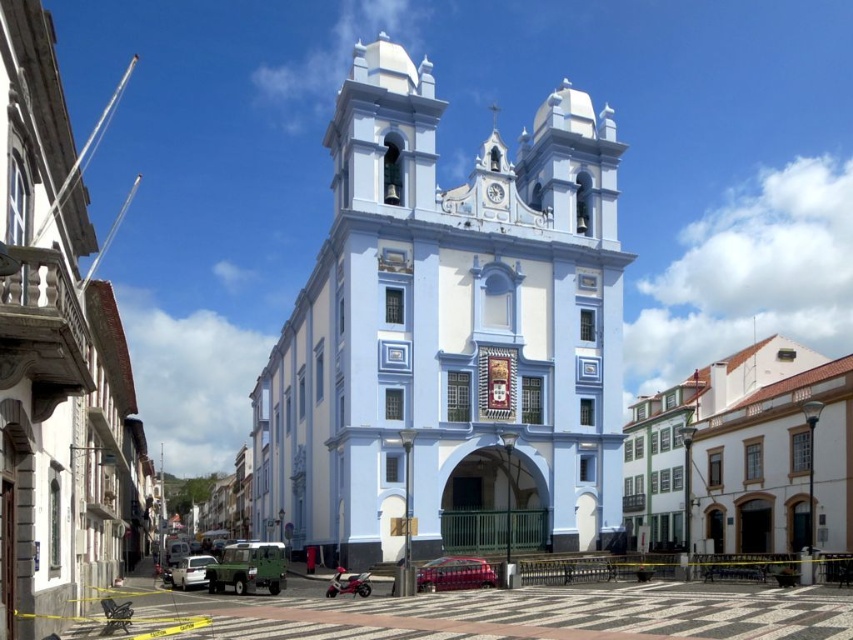
How distant is light blue painted stone church at center from green matte truck at center?

The distance of light blue painted stone church at center from green matte truck at center is 17.38 meters.

Is light blue painted stone church at center thinner than green matte truck at center?

No.

The height and width of the screenshot is (640, 853). Describe the element at coordinates (450, 337) in the screenshot. I see `light blue painted stone church at center` at that location.

Image resolution: width=853 pixels, height=640 pixels. I want to click on light blue painted stone church at center, so click(450, 337).

Between metallic red car at center and white matte car at lower left, which one is positioned lower?

white matte car at lower left is lower down.

Can you confirm if metallic red car at center is positioned to the left of white matte car at lower left?

Incorrect, metallic red car at center is not on the left side of white matte car at lower left.

What do you see at coordinates (454, 573) in the screenshot? I see `metallic red car at center` at bounding box center [454, 573].

This screenshot has height=640, width=853. What are the coordinates of `metallic red car at center` in the screenshot? It's located at (454, 573).

Does green matte truck at center appear over white matte car at lower left?

Indeed, green matte truck at center is positioned over white matte car at lower left.

Describe the element at coordinates (248, 566) in the screenshot. I see `green matte truck at center` at that location.

What do you see at coordinates (248, 566) in the screenshot?
I see `green matte truck at center` at bounding box center [248, 566].

Identify the location of green matte truck at center. This screenshot has width=853, height=640. (248, 566).